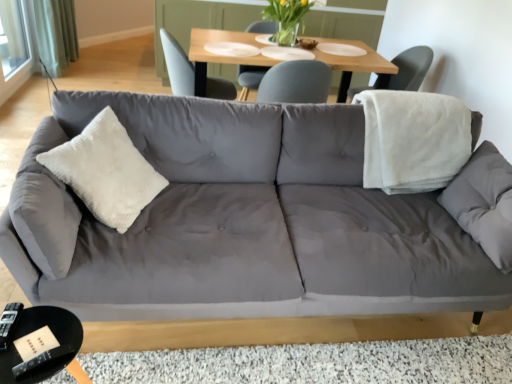
Question: Would you say white fleece blanket at right contains matte gray chair at upper center, which appears as the 2th chair when viewed from the right?

Choices:
 (A) yes
 (B) no

Answer: (B)

Question: Considering the relative sizes of white fleece blanket at right and matte gray chair at upper center, which appears as the 2th chair when viewed from the right, in the image provided, is white fleece blanket at right bigger than matte gray chair at upper center, which appears as the 2th chair when viewed from the right,?

Choices:
 (A) no
 (B) yes

Answer: (A)

Question: Does white fleece blanket at right touch matte gray chair at upper center, which appears as the 2th chair when viewed from the right?

Choices:
 (A) yes
 (B) no

Answer: (B)

Question: From the image's perspective, is white fleece blanket at right below matte gray chair at upper center, acting as the 1th chair starting from the left?

Choices:
 (A) no
 (B) yes

Answer: (B)

Question: From a real-world perspective, is white fleece blanket at right positioned under matte gray chair at upper center, acting as the 1th chair starting from the left, based on gravity?

Choices:
 (A) no
 (B) yes

Answer: (A)

Question: Would you say white corduroy pillow at center is to the left or to the right of white textured chair at upper right, the second chair in the left-to-right sequence, in the picture?

Choices:
 (A) left
 (B) right

Answer: (A)

Question: Is white corduroy pillow at center in front of or behind white textured chair at upper right, marked as the 1th chair in a right-to-left arrangement, in the image?

Choices:
 (A) front
 (B) behind

Answer: (A)

Question: Looking at their shapes, would you say white corduroy pillow at center is wider or thinner than white textured chair at upper right, marked as the 1th chair in a right-to-left arrangement?

Choices:
 (A) thin
 (B) wide

Answer: (A)

Question: From a real-world perspective, is white corduroy pillow at center above or below white textured chair at upper right, the second chair in the left-to-right sequence?

Choices:
 (A) below
 (B) above

Answer: (A)

Question: Looking at the image, does black glossy coffee table at lower left seem bigger or smaller compared to translucent glass vase at upper center?

Choices:
 (A) small
 (B) big

Answer: (A)

Question: From a real-world perspective, is black glossy coffee table at lower left physically located above or below translucent glass vase at upper center?

Choices:
 (A) above
 (B) below

Answer: (B)

Question: In terms of width, does black glossy coffee table at lower left look wider or thinner when compared to translucent glass vase at upper center?

Choices:
 (A) thin
 (B) wide

Answer: (A)

Question: Based on their positions, is black glossy coffee table at lower left located to the left or right of translucent glass vase at upper center?

Choices:
 (A) left
 (B) right

Answer: (A)

Question: From a real-world perspective, is gray fabric couch at center physically located above or below translucent glass vase at upper center?

Choices:
 (A) above
 (B) below

Answer: (B)

Question: Is gray fabric couch at center taller or shorter than translucent glass vase at upper center?

Choices:
 (A) short
 (B) tall

Answer: (B)